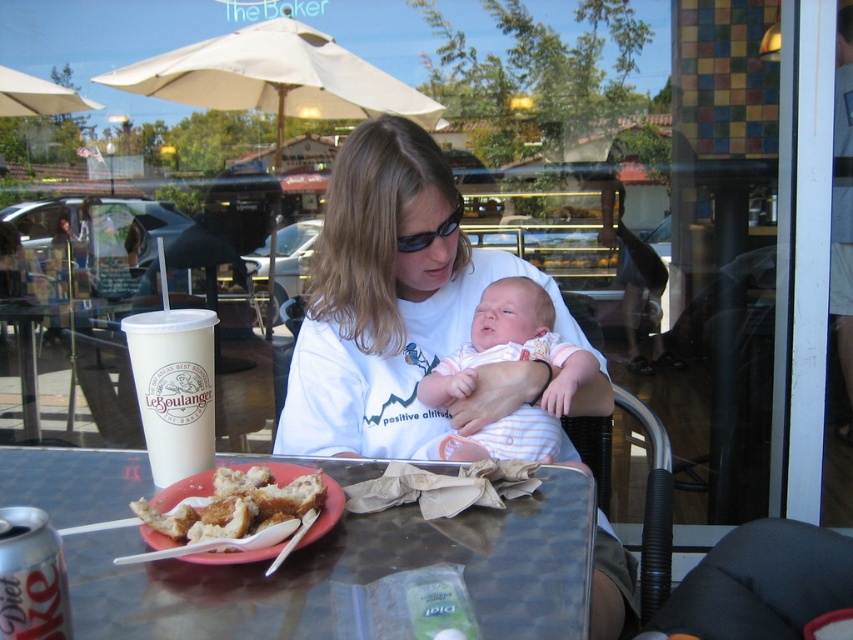
You are a parent at the bakery and want to choose a snack for your baby. You have the striped cotton onesie at center and the golden fried pastry at center. Which one is more appropriate to give to the baby?

The striped cotton onesie at center is more appropriate to give to the baby since it is a larger size compared to the golden fried pastry at center, making it easier for the baby to hold and consume safely.

You are a customer entering the bakery and see the white cotton shirt at center and the striped cotton onesie at center. Which clothing item is positioned to the left?

The white cotton shirt at center is to the left of the striped cotton onesie at center.

You are a fashion designer observing the scene at The Baker. You notice the white cotton shirt at center and the striped cotton onesie at center. Which clothing item is closer to the window?

The white cotton shirt at center and striped cotton onesie at center are 4.30 inches apart, but the description does not specify which is closer to the window. Therefore, it is impossible to determine which clothing item is closer based on the provided information.